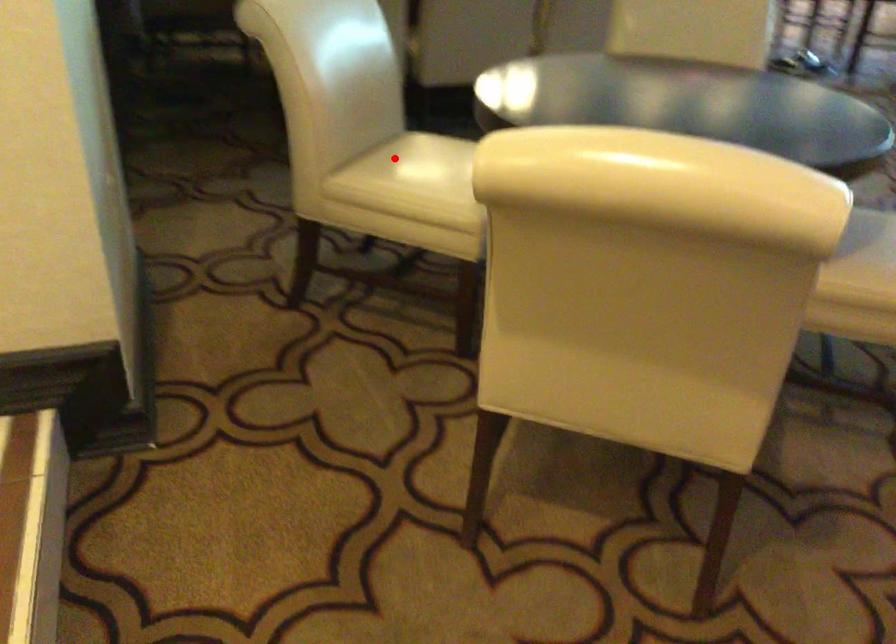
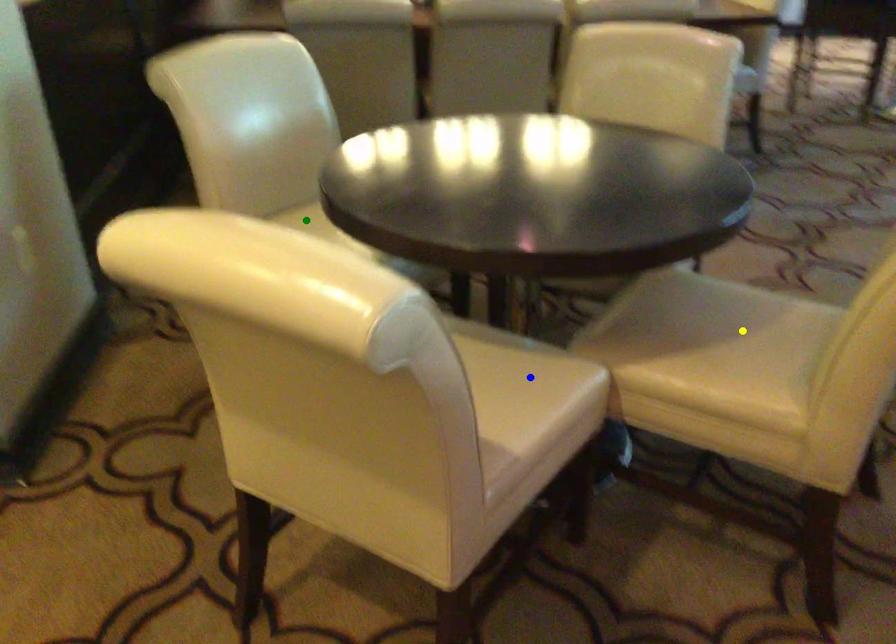
Question: I am providing you with two images of the same scene from different viewpoints. A red point is marked on the first image. You are given multiple points on the second image. Which mark in image 2 goes with the point in image 1?

Choices:
 (A) blue point
 (B) green point
 (C) yellow point

Answer: (B)